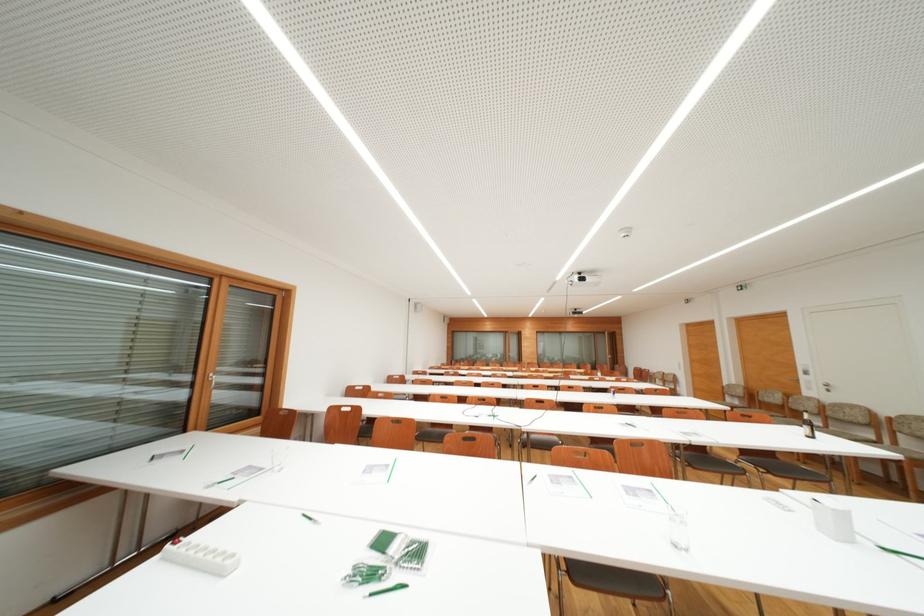
Find where to turn the metal window handle. Please return your answer as a coordinate pair (x, y).

(825, 387)